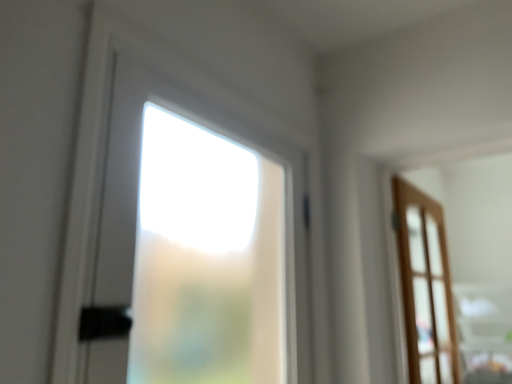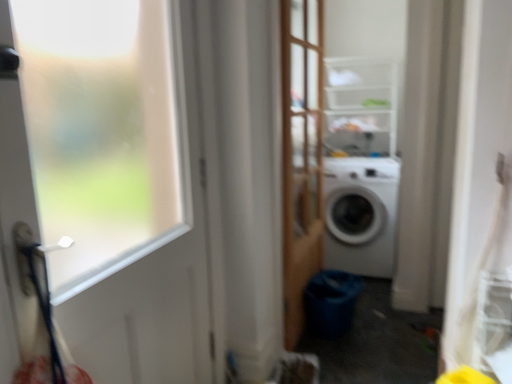
Question: How did the camera likely rotate when shooting the video?

Choices:
 (A) rotated upward
 (B) rotated downward

Answer: (B)